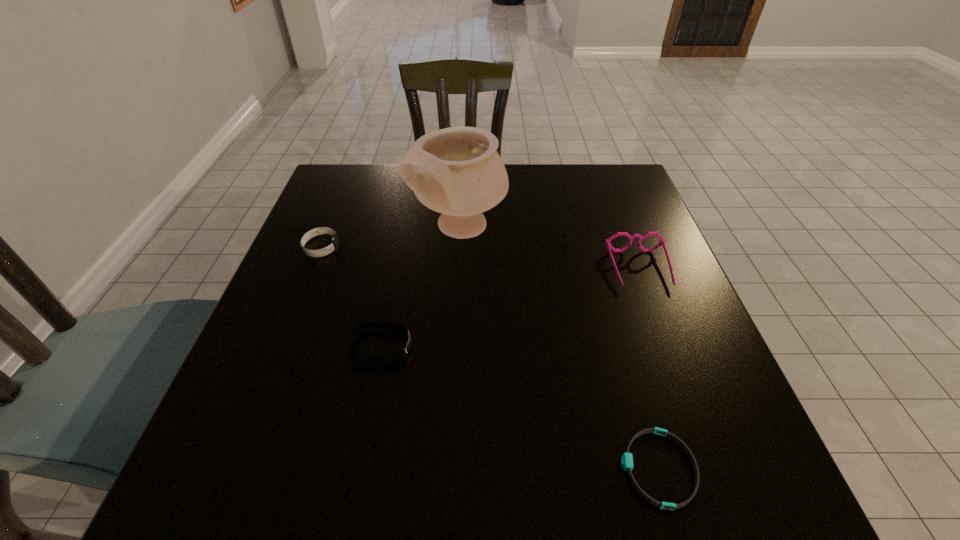
The image size is (960, 540). What are the coordinates of `vacant position located on the outer surface of the farthest wristband` in the screenshot? It's located at (360, 247).

This screenshot has width=960, height=540. I want to click on blank space located 0.270m on the display of the second shortest wristband, so click(x=556, y=347).

Locate an element on the screen. The image size is (960, 540). free point located 0.070m on the buckle of the nearest object is located at coordinates (575, 468).

Locate an element on the screen. The width and height of the screenshot is (960, 540). vacant space located 0.200m on the buckle of the nearest object is located at coordinates (489, 468).

At what (x,y) coordinates should I click in order to perform the action: click on vacant region located on the buckle of the nearest object. Please return your answer as a coordinate pair (x, y). The height and width of the screenshot is (540, 960). Looking at the image, I should click on (489, 468).

The height and width of the screenshot is (540, 960). What are the coordinates of `object located at the far edge` in the screenshot? It's located at (458, 172).

Locate an element on the screen. The height and width of the screenshot is (540, 960). object that is at the near edge is located at coordinates (627, 460).

Where is `object that is at the left edge`? This screenshot has height=540, width=960. object that is at the left edge is located at coordinates (333, 246).

The image size is (960, 540). Identify the location of spectacles that is at the right edge. (608, 241).

Where is `wristband located in the right edge section of the desktop`? wristband located in the right edge section of the desktop is located at coordinates (627, 460).